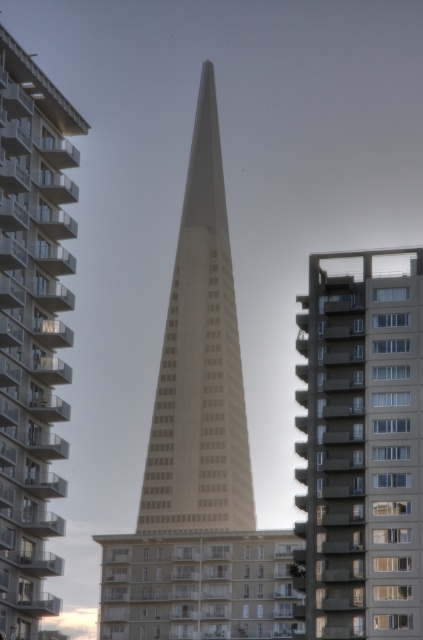
Based on the scene description, which of the two structures, the concrete building at center or the white concrete spire at center, is taller?

The white concrete spire at center is taller than the concrete building at center because the description states that the concrete building at center has a smaller size compared to the white concrete spire at center.

You are an architect analyzing the structural integrity of the beige concrete tower at center and the white concrete spire at center. Based on their thickness, which one might require more reinforcement to withstand high winds?

The white concrete spire at center is thicker than the beige concrete tower at center, so it might require more reinforcement to withstand high winds due to its greater thickness and potential weight.

You are an architect analyzing the spatial layout of the scene. Given that the concrete building at center and the beige concrete tower at center are both part of the same city block, which one would require a wider foundation to support its structure?

The concrete building at center requires a wider foundation because its width is larger than the beige concrete tower at center, necessitating a broader base for structural support.